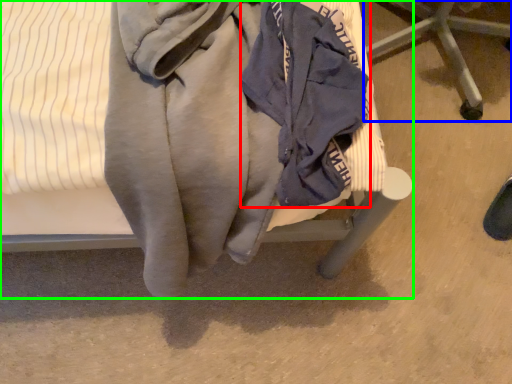
Question: Which object is positioned closest to garment (highlighted by a red box)? Select from furniture (highlighted by a blue box) and furniture (highlighted by a green box).

Choices:
 (A) furniture
 (B) furniture

Answer: (B)